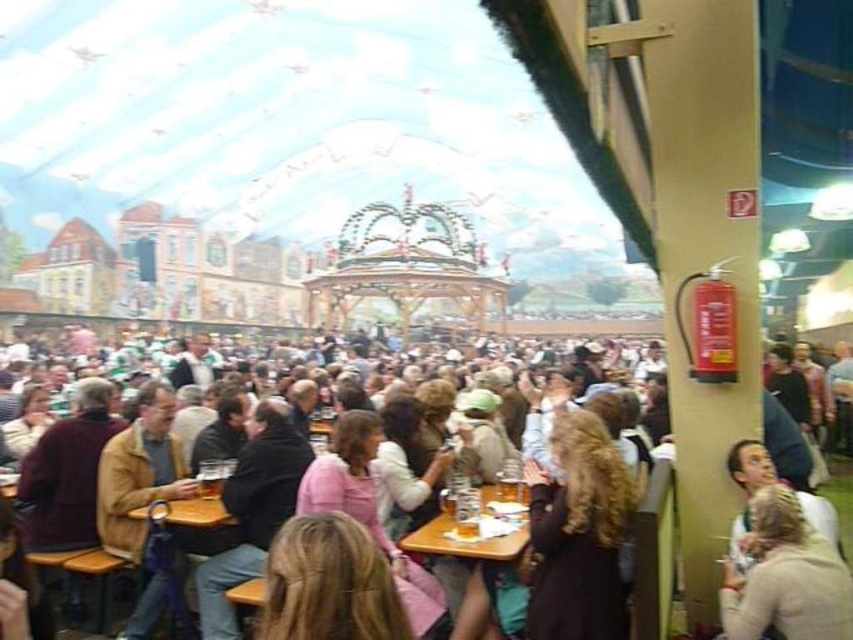
Question: Is matte brown jacket at center closer to camera compared to wooden table at center?

Choices:
 (A) yes
 (B) no

Answer: (A)

Question: Does matte brown jacket at center have a smaller size compared to wooden table at center?

Choices:
 (A) no
 (B) yes

Answer: (A)

Question: Which point is farther to the camera?

Choices:
 (A) (442, 532)
 (B) (219, 506)

Answer: (B)

Question: Considering the relative positions of matte brown jacket at center and wooden table at center in the image provided, where is matte brown jacket at center located with respect to wooden table at center?

Choices:
 (A) above
 (B) below

Answer: (A)

Question: Among these objects, which one is nearest to the camera?

Choices:
 (A) matte brown jacket at center
 (B) wooden table at center

Answer: (A)